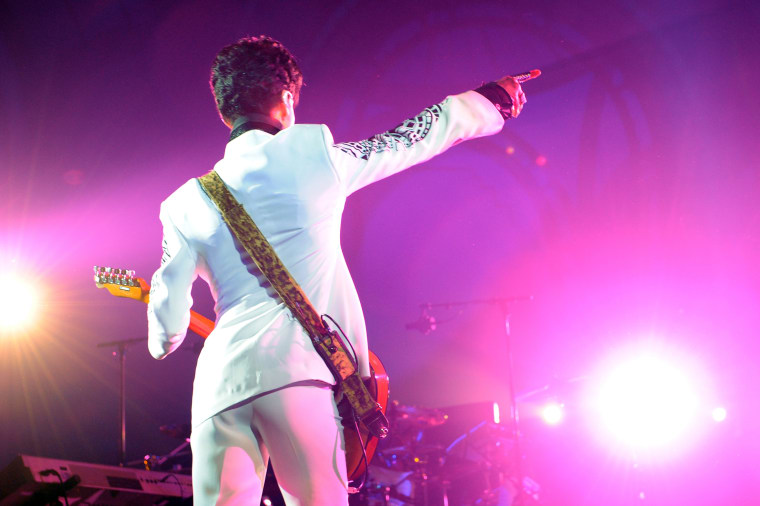
The width and height of the screenshot is (760, 506). In order to click on synthesizer in this screenshot , I will do `click(128, 469)`.